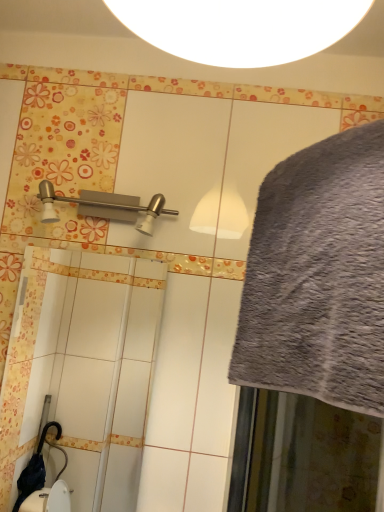
The image size is (384, 512). What do you see at coordinates (104, 207) in the screenshot?
I see `satin nickel shower at upper left` at bounding box center [104, 207].

What are the coordinates of `satin nickel shower at upper left` in the screenshot? It's located at (104, 207).

What is the approximate width of gray fluffy bath towel at right?

7.17 inches.

The height and width of the screenshot is (512, 384). What do you see at coordinates (318, 276) in the screenshot?
I see `gray fluffy bath towel at right` at bounding box center [318, 276].

In order to click on gray fluffy bath towel at right in this screenshot , I will do `click(318, 276)`.

The image size is (384, 512). In order to click on satin nickel shower at upper left in this screenshot , I will do `click(104, 207)`.

Which object is positioned more to the left, satin nickel shower at upper left or gray fluffy bath towel at right?

satin nickel shower at upper left.

Between satin nickel shower at upper left and gray fluffy bath towel at right, which one is positioned behind?

satin nickel shower at upper left is further away from the camera.

Is point (162, 204) positioned before point (277, 212)?

No, (162, 204) is further to viewer.

From the image's perspective, is satin nickel shower at upper left positioned above or below gray fluffy bath towel at right?

Clearly, from the image's perspective, satin nickel shower at upper left is above gray fluffy bath towel at right.

From a real-world perspective, between satin nickel shower at upper left and gray fluffy bath towel at right, who is vertically higher?

satin nickel shower at upper left, from a real-world perspective.

Based on the photo, which of these two, satin nickel shower at upper left or gray fluffy bath towel at right, is wider?

gray fluffy bath towel at right.

Can you confirm if satin nickel shower at upper left is shorter than gray fluffy bath towel at right?

Correct, satin nickel shower at upper left is not as tall as gray fluffy bath towel at right.

Between satin nickel shower at upper left and gray fluffy bath towel at right, which one has larger size?

gray fluffy bath towel at right is bigger.

Is satin nickel shower at upper left located outside gray fluffy bath towel at right?

Yes, satin nickel shower at upper left is outside of gray fluffy bath towel at right.

Is satin nickel shower at upper left far from gray fluffy bath towel at right?

No, satin nickel shower at upper left is in close proximity to gray fluffy bath towel at right.

Is satin nickel shower at upper left turned away from gray fluffy bath towel at right?

No.

Can you tell me how much satin nickel shower at upper left and gray fluffy bath towel at right differ in facing direction?

They differ by 42.6 degrees in their facing directions.

Locate an element on the screen. The height and width of the screenshot is (512, 384). bath towel that appears below the satin nickel shower at upper left (from the image's perspective) is located at coordinates (318, 276).

Which object is positioned more to the left, gray fluffy bath towel at right or satin nickel shower at upper left?

Positioned to the left is satin nickel shower at upper left.

Is the position of gray fluffy bath towel at right more distant than that of satin nickel shower at upper left?

No, it is not.

Between point (357, 362) and point (46, 205), which one is positioned behind?

Point (46, 205)

From the image's perspective, who appears lower, gray fluffy bath towel at right or satin nickel shower at upper left?

gray fluffy bath towel at right appears lower in the image.

From a real-world perspective, who is located lower, gray fluffy bath towel at right or satin nickel shower at upper left?

gray fluffy bath towel at right.

Considering the relative sizes of gray fluffy bath towel at right and satin nickel shower at upper left in the image provided, is gray fluffy bath towel at right wider than satin nickel shower at upper left?

Yes.

Considering the sizes of gray fluffy bath towel at right and satin nickel shower at upper left in the image, is gray fluffy bath towel at right taller or shorter than satin nickel shower at upper left?

In the image, gray fluffy bath towel at right appears to be taller than satin nickel shower at upper left.

Based on their sizes in the image, would you say gray fluffy bath towel at right is bigger or smaller than satin nickel shower at upper left?

In the image, gray fluffy bath towel at right appears to be larger than satin nickel shower at upper left.

Which is correct: gray fluffy bath towel at right is inside satin nickel shower at upper left, or outside of it?

gray fluffy bath towel at right exists outside the volume of satin nickel shower at upper left.

Is gray fluffy bath towel at right beside satin nickel shower at upper left?

No, gray fluffy bath towel at right is not beside satin nickel shower at upper left.

Is satin nickel shower at upper left at the back of gray fluffy bath towel at right?

gray fluffy bath towel at right does not have its back to satin nickel shower at upper left.

What's the angular difference between gray fluffy bath towel at right and satin nickel shower at upper left's facing directions?

42.6 degrees separate the facing orientations of gray fluffy bath towel at right and satin nickel shower at upper left.

The height and width of the screenshot is (512, 384). Identify the location of shower above the gray fluffy bath towel at right (from a real-world perspective). (104, 207).

Identify the location of bath towel on the right of the satin nickel shower at upper left. The height and width of the screenshot is (512, 384). (318, 276).

Locate an element on the screen. This screenshot has height=512, width=384. bath towel below the satin nickel shower at upper left (from a real-world perspective) is located at coordinates 318,276.